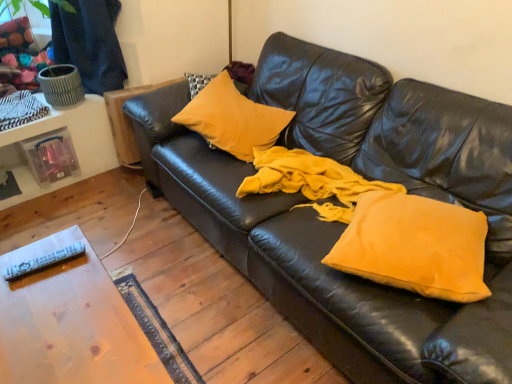
Question: Is white plastic remote at lower left shorter than matte yellow pillow at center, the 1th pillow positioned from the top?

Choices:
 (A) yes
 (B) no

Answer: (A)

Question: Is white plastic remote at lower left closer to the viewer compared to matte yellow pillow at center, placed as the 2th pillow when sorted from bottom to top?

Choices:
 (A) no
 (B) yes

Answer: (B)

Question: Does white plastic remote at lower left touch matte yellow pillow at center, placed as the 2th pillow when sorted from bottom to top?

Choices:
 (A) no
 (B) yes

Answer: (A)

Question: From a real-world perspective, does white plastic remote at lower left stand above matte yellow pillow at center, placed as the second pillow when sorted from front to back?

Choices:
 (A) yes
 (B) no

Answer: (A)

Question: Can you confirm if white plastic remote at lower left is taller than matte yellow pillow at center, placed as the second pillow when sorted from front to back?

Choices:
 (A) yes
 (B) no

Answer: (B)

Question: Can you confirm if white plastic remote at lower left is positioned to the right of matte yellow pillow at center, the 1th pillow positioned from the top?

Choices:
 (A) no
 (B) yes

Answer: (A)

Question: Does white plastic remote at lower left have a lesser width compared to wooden table at lower left?

Choices:
 (A) yes
 (B) no

Answer: (A)

Question: Is white plastic remote at lower left behind wooden table at lower left?

Choices:
 (A) yes
 (B) no

Answer: (A)

Question: Is white plastic remote at lower left to the right of wooden table at lower left from the viewer's perspective?

Choices:
 (A) no
 (B) yes

Answer: (A)

Question: Can you confirm if white plastic remote at lower left is taller than wooden table at lower left?

Choices:
 (A) no
 (B) yes

Answer: (A)

Question: Could you tell me if white plastic remote at lower left is facing wooden table at lower left?

Choices:
 (A) yes
 (B) no

Answer: (B)

Question: From a real-world perspective, is white plastic remote at lower left physically above wooden table at lower left?

Choices:
 (A) no
 (B) yes

Answer: (B)

Question: From the image's perspective, is matte yellow pillow at center, placed as the second pillow when sorted from front to back, located beneath wooden table at lower left?

Choices:
 (A) no
 (B) yes

Answer: (A)